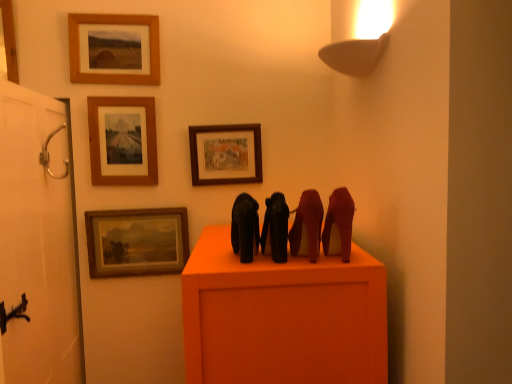
Describe the element at coordinates (226, 154) in the screenshot. I see `wooden picture frame at upper center, the 5th picture frame viewed from the left` at that location.

Describe the element at coordinates (9, 40) in the screenshot. I see `brushed metal picture frame at upper left, which appears as the 1th picture frame when viewed from the left` at that location.

Measure the distance between silver metallic door handle at left and camera.

silver metallic door handle at left and camera are 1.48 meters apart from each other.

Where is `satin red high-heels at right, the first animal when ordered from right to left`? satin red high-heels at right, the first animal when ordered from right to left is located at coordinates [x=339, y=224].

Is shiny black high-heels at center, placed as the second animal when sorted from right to left, far away from wooden picture frame at upper left, the fourth picture frame viewed from the right?

Absolutely, shiny black high-heels at center, placed as the second animal when sorted from right to left, is distant from wooden picture frame at upper left, the fourth picture frame viewed from the right.

From a real-world perspective, is shiny black high-heels at center, placed as the second animal when sorted from right to left, on wooden picture frame at upper left, the fourth picture frame viewed from the right?

Actually, shiny black high-heels at center, placed as the second animal when sorted from right to left, is physically below wooden picture frame at upper left, the fourth picture frame viewed from the right, in the real world.

Who is bigger, shiny black high-heels at center, placed as the second animal when sorted from right to left, or wooden picture frame at upper left, the fourth picture frame viewed from the right?

Bigger between the two is wooden picture frame at upper left, the fourth picture frame viewed from the right.

Considering the relative positions of shiny black high-heels at center, placed as the second animal when sorted from right to left, and wooden picture frame at upper left, the second picture frame from the left, in the image provided, is shiny black high-heels at center, placed as the second animal when sorted from right to left, behind wooden picture frame at upper left, the second picture frame from the left,?

No, it is not.

How different are the orientations of wooden picture frame at upper center, the 5th picture frame viewed from the left, and wooden framed painting at lower left, arranged as the 4th picture frame when viewed from the left, in degrees?

0.00157 degrees separate the facing orientations of wooden picture frame at upper center, the 5th picture frame viewed from the left, and wooden framed painting at lower left, arranged as the 4th picture frame when viewed from the left.

Considering the relative positions of wooden picture frame at upper center, the 5th picture frame viewed from the left, and wooden framed painting at lower left, arranged as the 4th picture frame when viewed from the left, in the image provided, is wooden picture frame at upper center, the 5th picture frame viewed from the left, in front of wooden framed painting at lower left, arranged as the 4th picture frame when viewed from the left,?

Yes, wooden picture frame at upper center, the 5th picture frame viewed from the left, is closer to the camera.

From a real-world perspective, who is located higher, wooden picture frame at upper center, the first picture frame positioned from the right, or wooden framed painting at lower left, the 2th picture frame viewed from the right?

wooden picture frame at upper center, the first picture frame positioned from the right.

In terms of width, does wooden picture frame at upper center, the 5th picture frame viewed from the left, look wider or thinner when compared to wooden framed painting at lower left, the 2th picture frame viewed from the right?

Considering their sizes, wooden picture frame at upper center, the 5th picture frame viewed from the left, looks slimmer than wooden framed painting at lower left, the 2th picture frame viewed from the right.

Between satin red high-heels at right, the first animal when ordered from right to left, and wooden picture frame at upper center, the first picture frame positioned from the right, which one has larger size?

satin red high-heels at right, the first animal when ordered from right to left, is bigger.

In the image, is satin red high-heels at right, the 4th animal viewed from the left, on the left side or the right side of wooden picture frame at upper center, the first picture frame positioned from the right?

satin red high-heels at right, the 4th animal viewed from the left, is to the right of wooden picture frame at upper center, the first picture frame positioned from the right.

From a real-world perspective, is satin red high-heels at right, the first animal when ordered from right to left, positioned over wooden picture frame at upper center, the first picture frame positioned from the right, based on gravity?

Actually, satin red high-heels at right, the first animal when ordered from right to left, is physically below wooden picture frame at upper center, the first picture frame positioned from the right, in the real world.

What's the angular difference between brushed metal picture frame at upper left, the fifth picture frame in the right-to-left sequence, and wooden picture frame at upper center, the 5th picture frame viewed from the left,'s facing directions?

The angular difference between brushed metal picture frame at upper left, the fifth picture frame in the right-to-left sequence, and wooden picture frame at upper center, the 5th picture frame viewed from the left, is 0.993 degrees.

Considering the sizes of objects brushed metal picture frame at upper left, the fifth picture frame in the right-to-left sequence, and wooden picture frame at upper center, the first picture frame positioned from the right, in the image provided, who is smaller, brushed metal picture frame at upper left, the fifth picture frame in the right-to-left sequence, or wooden picture frame at upper center, the first picture frame positioned from the right,?

wooden picture frame at upper center, the first picture frame positioned from the right.

From the image's perspective, who appears lower, brushed metal picture frame at upper left, which appears as the 1th picture frame when viewed from the left, or wooden picture frame at upper center, the 5th picture frame viewed from the left?

wooden picture frame at upper center, the 5th picture frame viewed from the left.

From a real-world perspective, does brushed metal picture frame at upper left, the fifth picture frame in the right-to-left sequence, sit lower than wooden picture frame at upper center, the first picture frame positioned from the right?

Actually, brushed metal picture frame at upper left, the fifth picture frame in the right-to-left sequence, is physically above wooden picture frame at upper center, the first picture frame positioned from the right, in the real world.

Is satin red high-heels at right, the first animal when ordered from right to left, bigger than shiny black high-heels at center, placed as the second animal when sorted from right to left?

Indeed, satin red high-heels at right, the first animal when ordered from right to left, has a larger size compared to shiny black high-heels at center, placed as the second animal when sorted from right to left.

Considering the relative positions of satin red high-heels at right, the first animal when ordered from right to left, and shiny black high-heels at center, acting as the 3th animal starting from the left, in the image provided, is satin red high-heels at right, the first animal when ordered from right to left, to the left of shiny black high-heels at center, acting as the 3th animal starting from the left, from the viewer's perspective?

In fact, satin red high-heels at right, the first animal when ordered from right to left, is to the right of shiny black high-heels at center, acting as the 3th animal starting from the left.

Is satin red high-heels at right, the 4th animal viewed from the left, oriented towards shiny black high-heels at center, placed as the second animal when sorted from right to left?

No.

From a real-world perspective, is satin red high-heels at right, the first animal when ordered from right to left, located beneath shiny black high-heels at center, placed as the second animal when sorted from right to left?

No, from a real-world perspective, satin red high-heels at right, the first animal when ordered from right to left, is not beneath shiny black high-heels at center, placed as the second animal when sorted from right to left.

Could you tell me if black matte elephant at center, marked as the 3th animal in a right-to-left arrangement, is facing wooden framed painting at lower left, the 2th picture frame viewed from the right?

No, black matte elephant at center, marked as the 3th animal in a right-to-left arrangement, is not aimed at wooden framed painting at lower left, the 2th picture frame viewed from the right.

Considering the sizes of objects black matte elephant at center, marked as the 3th animal in a right-to-left arrangement, and wooden framed painting at lower left, arranged as the 4th picture frame when viewed from the left, in the image provided, who is wider, black matte elephant at center, marked as the 3th animal in a right-to-left arrangement, or wooden framed painting at lower left, arranged as the 4th picture frame when viewed from the left,?

black matte elephant at center, marked as the 3th animal in a right-to-left arrangement.

From a real-world perspective, is black matte elephant at center, marked as the second animal in a left-to-right arrangement, located higher than wooden framed painting at lower left, arranged as the 4th picture frame when viewed from the left?

→ Yes, from a real-world perspective, black matte elephant at center, marked as the second animal in a left-to-right arrangement, is on top of wooden framed painting at lower left, arranged as the 4th picture frame when viewed from the left.

From a real-world perspective, is black matte elephant at center, marked as the 3th animal in a right-to-left arrangement, located higher than black matte elephant at center, which ranks as the first animal in left-to-right order?

Incorrect, from a real-world perspective, black matte elephant at center, marked as the 3th animal in a right-to-left arrangement, is lower than black matte elephant at center, which ranks as the first animal in left-to-right order.

What's the angular difference between black matte elephant at center, marked as the 3th animal in a right-to-left arrangement, and black matte elephant at center, which ranks as the first animal in left-to-right order,'s facing directions?

They differ by 0.000471 degrees in their facing directions.

Which is more to the right, black matte elephant at center, marked as the second animal in a left-to-right arrangement, or black matte elephant at center, which ranks as the first animal in left-to-right order?

black matte elephant at center, marked as the second animal in a left-to-right arrangement, is more to the right.

From the picture: Which of these two, black matte elephant at center, marked as the 3th animal in a right-to-left arrangement, or black matte elephant at center, which ranks as the first animal in left-to-right order, is smaller?

Smaller between the two is black matte elephant at center, marked as the 3th animal in a right-to-left arrangement.

From a real-world perspective, count 2nd animals downward from the wooden picture frame at upper left, the second picture frame from the left, and point to it. Please provide its 2D coordinates.

[(307, 226)]

This screenshot has height=384, width=512. Identify the location of the 1st picture frame above the wooden framed painting at lower left, arranged as the 4th picture frame when viewed from the left (from the image's perspective). (226, 154).

Based on their spatial positions, is wooden picture frame at upper center, the first picture frame positioned from the right, or silver metallic door handle at left further from black matte elephant at center, which ranks as the first animal in left-to-right order?

The object further to black matte elephant at center, which ranks as the first animal in left-to-right order, is silver metallic door handle at left.

Considering their positions, is satin red high-heels at right, the 4th animal viewed from the left, positioned closer to wooden framed painting at lower left, arranged as the 4th picture frame when viewed from the left, than silver metallic door handle at left?

silver metallic door handle at left lies closer to wooden framed painting at lower left, arranged as the 4th picture frame when viewed from the left, than the other object.

Based on their spatial positions, is satin red high-heels at right, the 4th animal viewed from the left, or black matte elephant at center, the 4th animal when ordered from right to left, closer to shiny black high-heels at center, acting as the 3th animal starting from the left?

The object closer to shiny black high-heels at center, acting as the 3th animal starting from the left, is satin red high-heels at right, the 4th animal viewed from the left.

Estimate the real-world distances between objects in this image. Which object is further from silver metallic door handle at left, black matte elephant at center, marked as the second animal in a left-to-right arrangement, or satin red high-heels at right, the first animal when ordered from right to left?

Among the two, satin red high-heels at right, the first animal when ordered from right to left, is located further to silver metallic door handle at left.

Looking at the image, which one is located further to satin red high-heels at right, the 4th animal viewed from the left, black matte elephant at center, marked as the 3th animal in a right-to-left arrangement, or wooden framed painting at lower left, arranged as the 4th picture frame when viewed from the left?

wooden framed painting at lower left, arranged as the 4th picture frame when viewed from the left, lies further to satin red high-heels at right, the 4th animal viewed from the left, than the other object.

Considering their positions, is silver metallic door handle at left positioned further to black matte elephant at center, the 4th animal when ordered from right to left, than wooden frame at upper center, the 3th picture frame in the right-to-left sequence?

Based on the image, silver metallic door handle at left appears to be further to black matte elephant at center, the 4th animal when ordered from right to left.

Looking at the image, which one is located closer to satin red high-heels at right, the first animal when ordered from right to left, wooden picture frame at upper center, the 5th picture frame viewed from the left, or brushed metal picture frame at upper left, which appears as the 1th picture frame when viewed from the left?

Based on the image, wooden picture frame at upper center, the 5th picture frame viewed from the left, appears to be nearer to satin red high-heels at right, the first animal when ordered from right to left.

Estimate the real-world distances between objects in this image. Which object is closer to satin red high-heels at right, the first animal when ordered from right to left, wooden frame at upper center, the 3th picture frame in the right-to-left sequence, or wooden framed painting at lower left, arranged as the 4th picture frame when viewed from the left?

wooden framed painting at lower left, arranged as the 4th picture frame when viewed from the left, lies closer to satin red high-heels at right, the first animal when ordered from right to left, than the other object.

This screenshot has width=512, height=384. Find the location of `door handle between brushed metal picture frame at upper left, the fifth picture frame in the right-to-left sequence, and satin red high-heels at right, the first animal when ordered from right to left, in the horizontal direction`. door handle between brushed metal picture frame at upper left, the fifth picture frame in the right-to-left sequence, and satin red high-heels at right, the first animal when ordered from right to left, in the horizontal direction is located at coordinates (49, 155).

Find the location of a particular element. Image resolution: width=512 pixels, height=384 pixels. animal between brushed metal picture frame at upper left, the fifth picture frame in the right-to-left sequence, and black matte elephant at center, marked as the 3th animal in a right-to-left arrangement, in the horizontal direction is located at coordinates (245, 227).

Locate an element on the screen. picture frame between brushed metal picture frame at upper left, which appears as the 1th picture frame when viewed from the left, and wooden frame at upper center, which appears as the third picture frame when viewed from the left is located at coordinates (113, 50).

Where is `door handle between brushed metal picture frame at upper left, which appears as the 1th picture frame when viewed from the left, and wooden picture frame at upper left, the second picture frame from the left, from left to right`? The width and height of the screenshot is (512, 384). door handle between brushed metal picture frame at upper left, which appears as the 1th picture frame when viewed from the left, and wooden picture frame at upper left, the second picture frame from the left, from left to right is located at coordinates (49, 155).